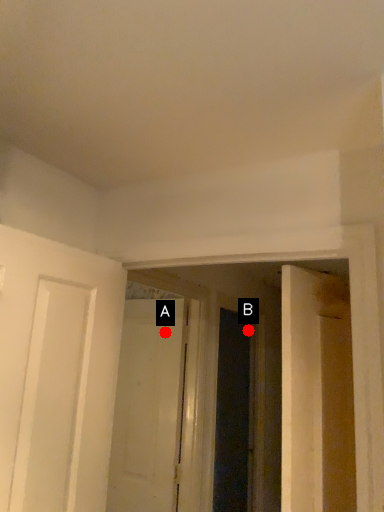
Question: Two points are circled on the image, labeled by A and B beside each circle. Which of the following is the farthest from the observer?

Choices:
 (A) A is further
 (B) B is further

Answer: (B)